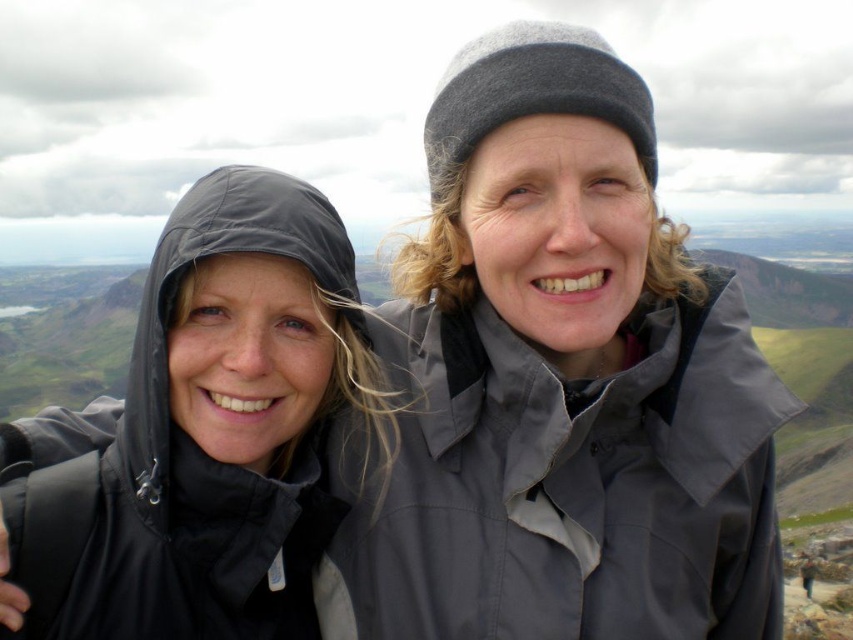
Question: Which point is closer to the camera taking this photo?

Choices:
 (A) (184, 596)
 (B) (341, 570)

Answer: (A)

Question: Is matte gray jacket at center to the left of matte black raincoat at left from the viewer's perspective?

Choices:
 (A) yes
 (B) no

Answer: (B)

Question: Among these points, which one is farthest from the camera?

Choices:
 (A) (218, 596)
 (B) (492, 294)

Answer: (B)

Question: Is the position of matte gray jacket at center more distant than that of matte black raincoat at left?

Choices:
 (A) yes
 (B) no

Answer: (A)

Question: Can you confirm if matte gray jacket at center is positioned above matte black raincoat at left?

Choices:
 (A) no
 (B) yes

Answer: (B)